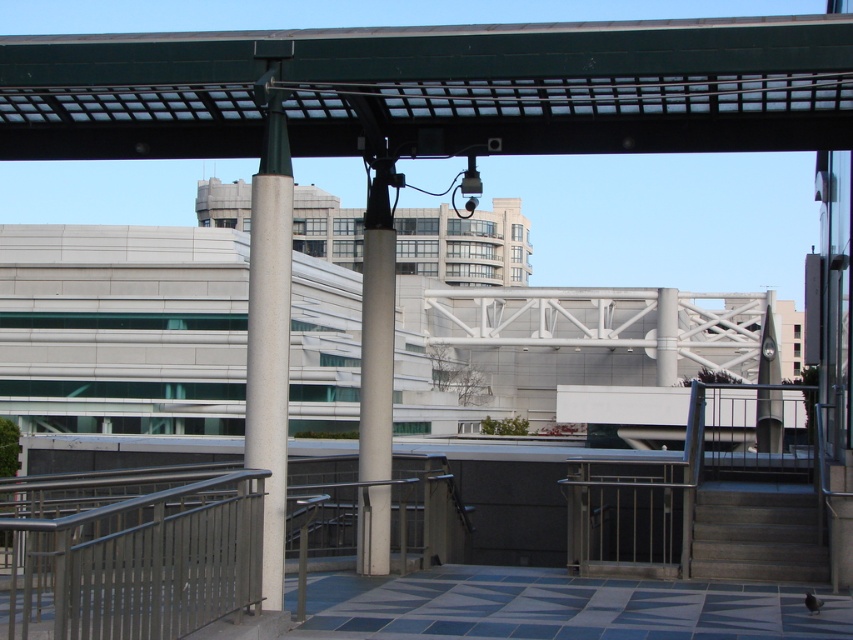
Question: Does white concrete pillar at left lie behind dark gray concrete stairs at lower right?

Choices:
 (A) yes
 (B) no

Answer: (B)

Question: Which object is positioned closest to the white smooth pole at center?

Choices:
 (A) dark gray concrete stairs at lower right
 (B) white concrete pillar at left

Answer: (B)

Question: Which point appears farthest from the camera in this image?

Choices:
 (A) pyautogui.click(x=791, y=561)
 (B) pyautogui.click(x=270, y=460)
 (C) pyautogui.click(x=392, y=252)

Answer: (A)

Question: Can you confirm if white smooth pole at center is wider than dark gray concrete stairs at lower right?

Choices:
 (A) no
 (B) yes

Answer: (B)

Question: Does white concrete pillar at left have a larger size compared to dark gray concrete stairs at lower right?

Choices:
 (A) yes
 (B) no

Answer: (A)

Question: Considering the real-world distances, which object is farthest from the white smooth pole at center?

Choices:
 (A) dark gray concrete stairs at lower right
 (B) white concrete pillar at left

Answer: (A)